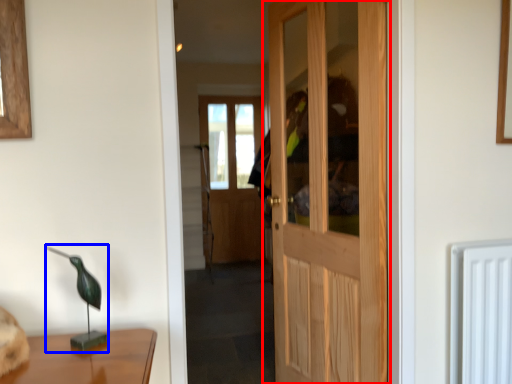
Question: Among these objects, which one is farthest to the camera, door (highlighted by a red box) or table lamp (highlighted by a blue box)?

Choices:
 (A) door
 (B) table lamp

Answer: (A)